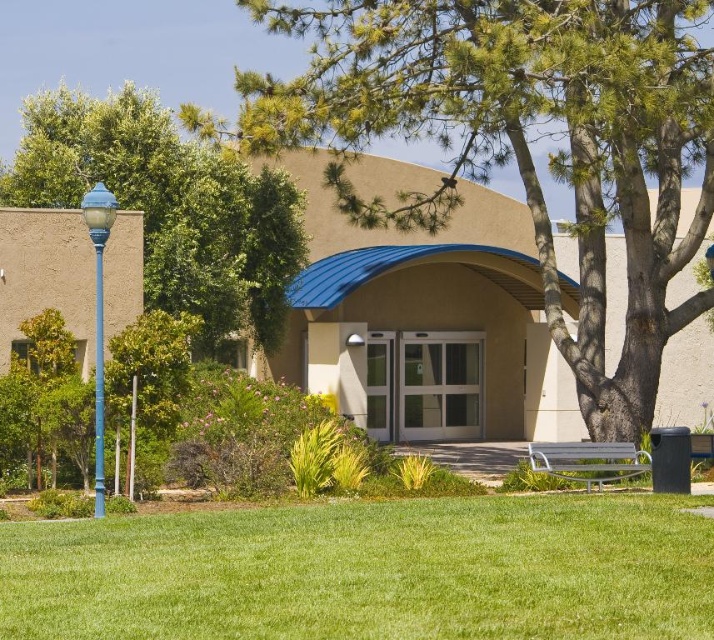
You are a gardener planning to plant a new tree in the area. Given the space available, which object between the green leafy tree at center and the green grass at lower center would you consider for placement, and why?

The green leafy tree at center has a larger width than the green grass at lower center, so the space available might be more suitable for the tree rather than the grass.

You are a visitor arriving at the entrance of the building and want to rest. You see the green grass at lower center and the metallic silver bench at lower right. Which one is a better option for sitting?

The metallic silver bench at lower right is a better option for sitting because the green grass at lower center has a smaller size compared to the bench, meaning the bench provides a larger and more comfortable seating area.

You are a visitor arriving at the entrance of the building. You see the green grass at lower center and the metallic silver bench at lower right. Which object is closer to you as you approach the entrance?

The green grass at lower center is closer to you because it is in front of the metallic silver bench at lower right.